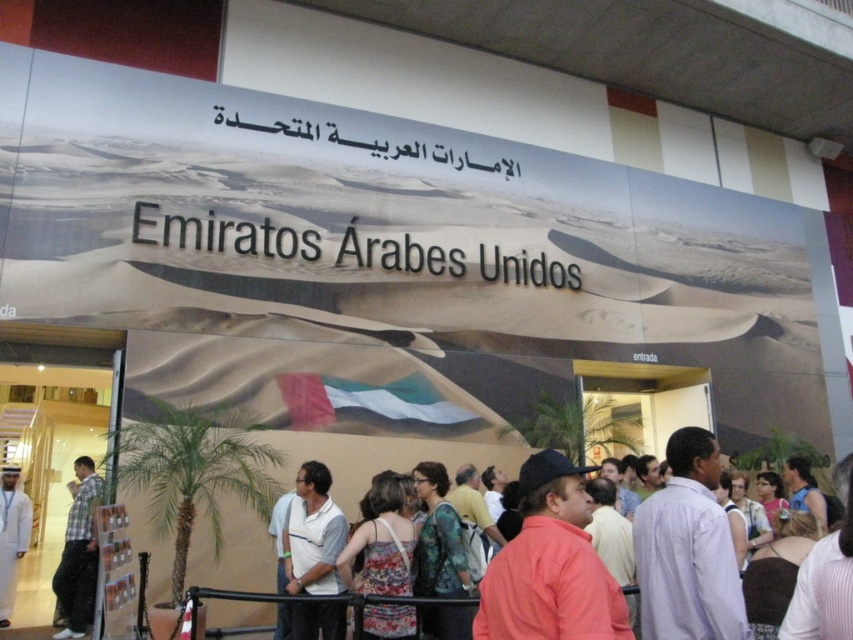
Is point (155, 243) positioned behind point (303, 564)?

Yes.

The width and height of the screenshot is (853, 640). What do you see at coordinates (347, 248) in the screenshot?
I see `black metallic sign at center` at bounding box center [347, 248].

At what (x,y) coordinates should I click in order to perform the action: click on black metallic sign at center. Please return your answer as a coordinate pair (x, y). Looking at the image, I should click on [347, 248].

Which is above, plaid cotton shirt at left or white fabric at center?

Positioned higher is plaid cotton shirt at left.

Can you confirm if plaid cotton shirt at left is shorter than white fabric at center?

No.

The image size is (853, 640). Find the location of `plaid cotton shirt at left`. plaid cotton shirt at left is located at coordinates (78, 554).

In order to click on plaid cotton shirt at left in this screenshot , I will do `click(78, 554)`.

Does white matte shirt at center have a lesser width compared to plaid cotton shirt at left?

Indeed, white matte shirt at center has a lesser width compared to plaid cotton shirt at left.

Between white matte shirt at center and plaid cotton shirt at left, which one has less height?

With less height is white matte shirt at center.

Is point (299, 548) positioned in front of point (62, 593)?

That is True.

Where is `white matte shirt at center`? white matte shirt at center is located at coordinates (312, 534).